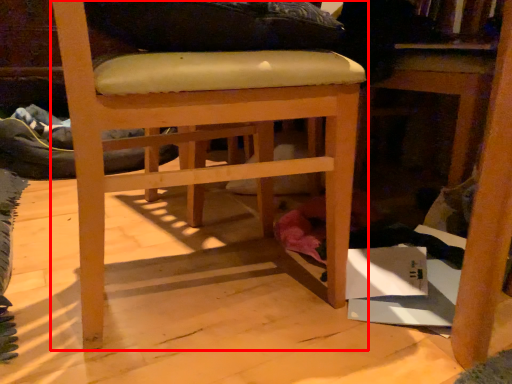
Question: From the image's perspective, what is the correct spatial positioning of chair (annotated by the red box) in reference to table?

Choices:
 (A) above
 (B) below

Answer: (B)